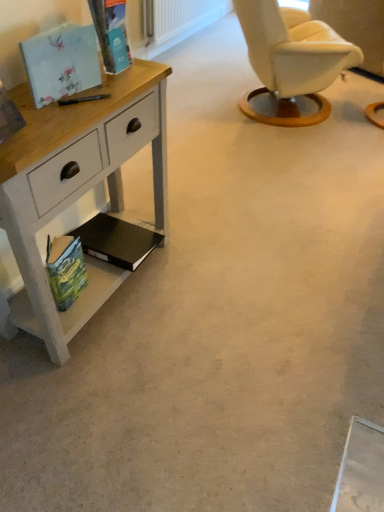
Find the location of `free space in front of matte cardboard magazine at upper left, which is the fourth magazine in bottom-to-top order`. free space in front of matte cardboard magazine at upper left, which is the fourth magazine in bottom-to-top order is located at coordinates pyautogui.click(x=107, y=93).